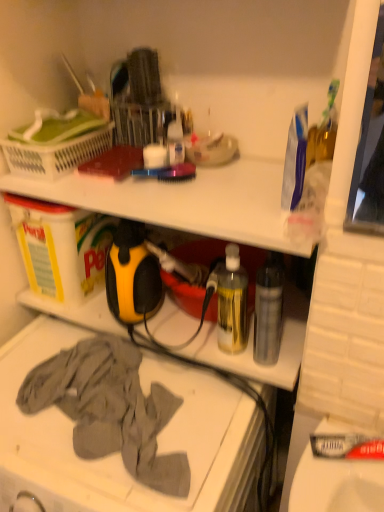
Question: In terms of width, does white plastic laundry basket at upper left look wider or thinner when compared to gray cotton cloth at lower left?

Choices:
 (A) thin
 (B) wide

Answer: (B)

Question: From their relative heights in the image, would you say white plastic laundry basket at upper left is taller or shorter than gray cotton cloth at lower left?

Choices:
 (A) short
 (B) tall

Answer: (A)

Question: Which object is positioned closest to the gray cotton cloth at lower left?

Choices:
 (A) translucent plastic bottle at center, acting as the 1th bottle starting from the left
 (B) white plastic laundry basket at upper left
 (C) transparent plastic bottle at center-right, acting as the 1th bottle starting from the right

Answer: (A)

Question: Considering the real-world distances, which object is farthest from the translucent plastic bottle at center, acting as the 1th bottle starting from the left?

Choices:
 (A) gray cotton cloth at lower left
 (B) white plastic laundry basket at upper left
 (C) transparent plastic bottle at center-right, acting as the 1th bottle starting from the right

Answer: (B)